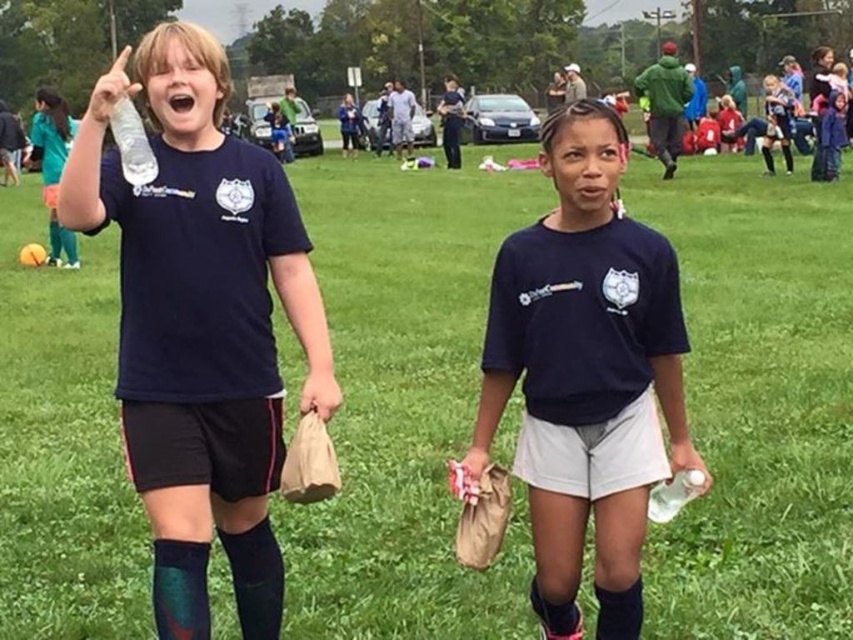
Question: Based on their relative distances, which object is nearer to the clear plastic bottle at upper left?

Choices:
 (A) clear plastic bottle at lower right
 (B) matte black water bottle at left
 (C) black knit sock at lower right

Answer: (B)

Question: Is clear plastic bottle at upper left positioned before black knit sock at lower right?

Choices:
 (A) yes
 (B) no

Answer: (A)

Question: Is clear plastic bottle at upper left bigger than clear plastic bottle at lower right?

Choices:
 (A) yes
 (B) no

Answer: (B)

Question: Is clear plastic bottle at upper left positioned behind clear plastic bottle at lower right?

Choices:
 (A) no
 (B) yes

Answer: (A)

Question: Based on their relative distances, which object is farther from the clear plastic bottle at lower right?

Choices:
 (A) matte black shirt at center
 (B) clear plastic bottle at upper left

Answer: (B)

Question: Which point is farther to the camera?

Choices:
 (A) (241, 328)
 (B) (596, 595)
 (C) (625, 378)

Answer: (A)